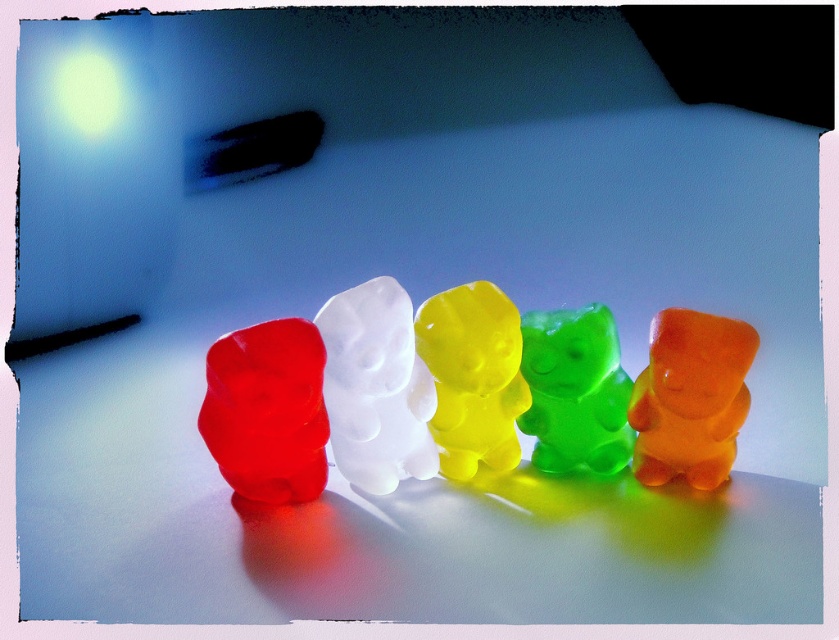
Which is behind, point (565, 364) or point (498, 436)?

Point (498, 436)

From the picture: Can you confirm if translucent gelatin bear at center is taller than translucent yellow bear at center?

Yes.

Does point (370, 438) come in front of point (509, 436)?

Yes.

The width and height of the screenshot is (839, 640). I want to click on translucent gelatin bear at center, so click(378, 392).

Which is below, translucent white bear at center or translucent orange gummy bear at right?

translucent orange gummy bear at right is below.

Image resolution: width=839 pixels, height=640 pixels. What are the coordinates of `translucent white bear at center` in the screenshot? It's located at (376, 387).

Does matte translucent gummy bear at left come behind translucent yellow bear at center?

No, it is in front of translucent yellow bear at center.

Based on the photo, can you confirm if matte translucent gummy bear at left is bigger than translucent yellow bear at center?

Indeed, matte translucent gummy bear at left has a larger size compared to translucent yellow bear at center.

Does point (277, 460) lie in front of point (456, 477)?

Yes, it is.

Where is `matte translucent gummy bear at left`? The width and height of the screenshot is (839, 640). matte translucent gummy bear at left is located at coordinates (267, 410).